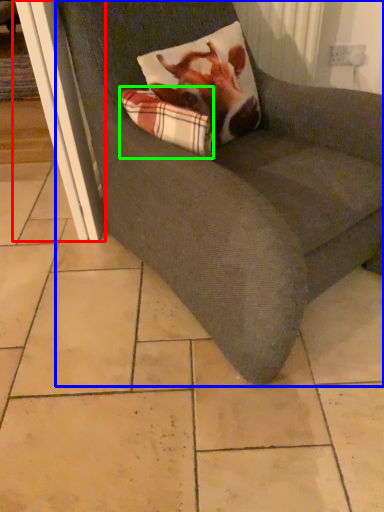
Question: Which object is the farthest from screen door (highlighted by a red box)? Choose among these: chair (highlighted by a blue box) or plaid (highlighted by a green box).

Choices:
 (A) chair
 (B) plaid

Answer: (A)